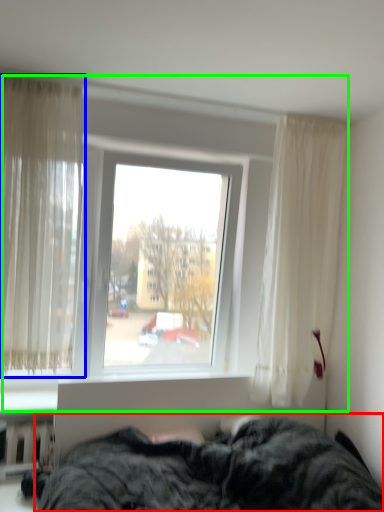
Question: Based on their relative distances, which object is nearer to bed (highlighted by a red box)? Choose from curtain (highlighted by a blue box) and window (highlighted by a green box).

Choices:
 (A) curtain
 (B) window

Answer: (B)